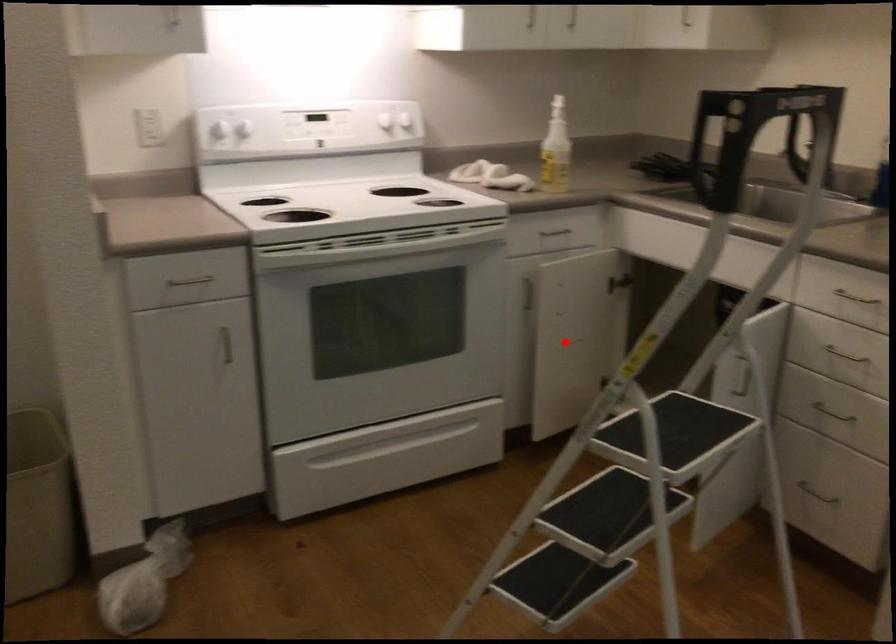
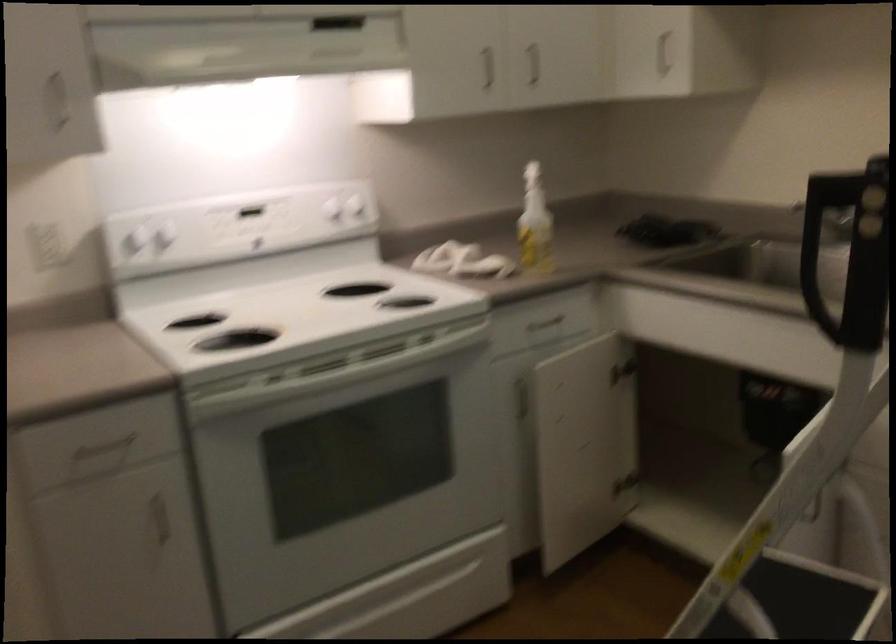
Find the pixel in the second image that matches the highlighted location in the first image.

(574, 448)